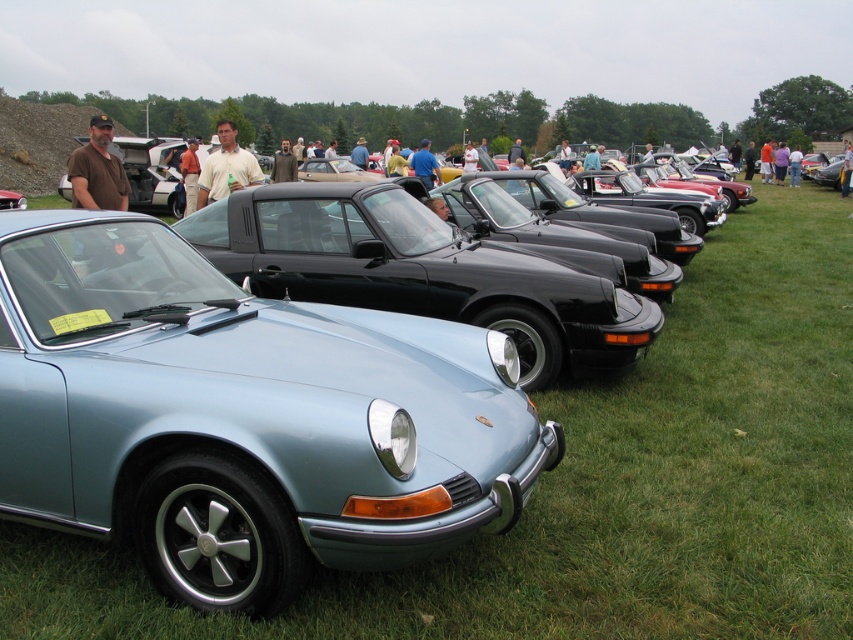
Is brown cap at upper left shorter than matte white shirt at center?

In fact, brown cap at upper left may be taller than matte white shirt at center.

Which is below, brown cap at upper left or matte white shirt at center?

matte white shirt at center is lower down.

What do you see at coordinates (97, 170) in the screenshot? I see `brown cap at upper left` at bounding box center [97, 170].

You are a GUI agent. You are given a task and a screenshot of the screen. Output one action in this format:
    pyautogui.click(x=<x>, y=<y>)
    Task: Click on the brown cap at upper left
    The height and width of the screenshot is (640, 853).
    Given the screenshot: What is the action you would take?
    pyautogui.click(x=97, y=170)

Is matte white shirt at center positioned at the back of orange cotton shirt at center?

No, matte white shirt at center is in front of orange cotton shirt at center.

Can you confirm if matte white shirt at center is positioned to the left of orange cotton shirt at center?

No, matte white shirt at center is not to the left of orange cotton shirt at center.

Which is behind, point (222, 195) or point (190, 204)?

Point (190, 204)

The height and width of the screenshot is (640, 853). Find the location of `matte white shirt at center`. matte white shirt at center is located at coordinates (225, 168).

Can you confirm if brown cap at upper left is positioned below orange cotton shirt at center?

No.

Which is more to the right, brown cap at upper left or orange cotton shirt at center?

From the viewer's perspective, orange cotton shirt at center appears more on the right side.

Identify the location of brown cap at upper left. (97, 170).

You are a GUI agent. You are given a task and a screenshot of the screen. Output one action in this format:
    pyautogui.click(x=<x>, y=<y>)
    Task: Click on the brown cap at upper left
    This screenshot has width=853, height=640.
    Given the screenshot: What is the action you would take?
    pyautogui.click(x=97, y=170)